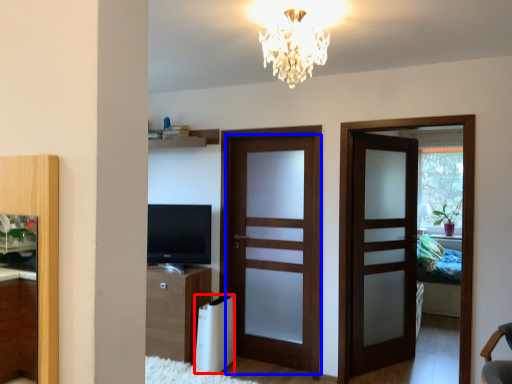
Question: Which of the following is the closest to the observer, appliance (highlighted by a red box) or door (highlighted by a blue box)?

Choices:
 (A) appliance
 (B) door

Answer: (A)